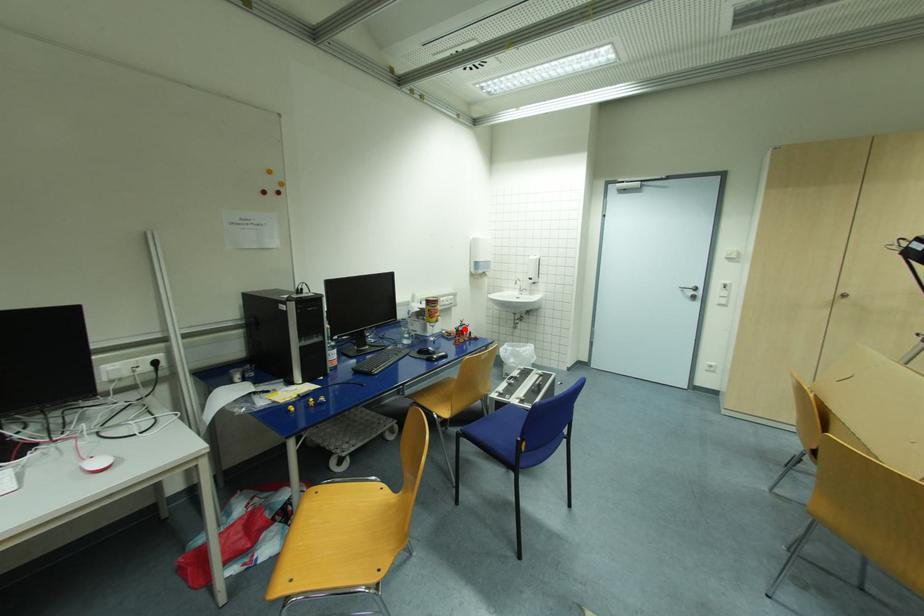
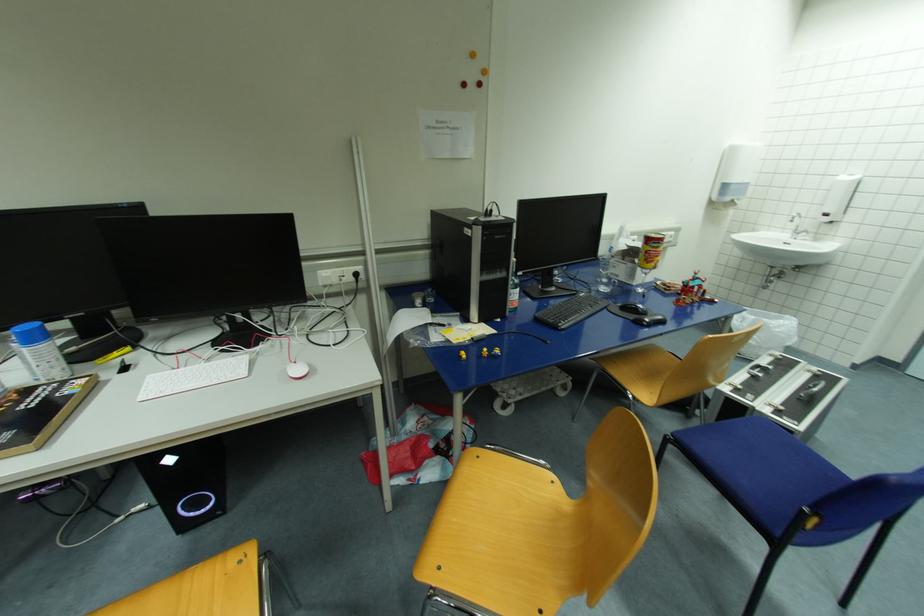
Question: I am providing you with two images of the same scene from different viewpoints. In image1, a red point is highlighted. Considering the same 3D point in image2, which of the following is correct?

Choices:
 (A) It is closer
 (B) It is farther

Answer: (A)